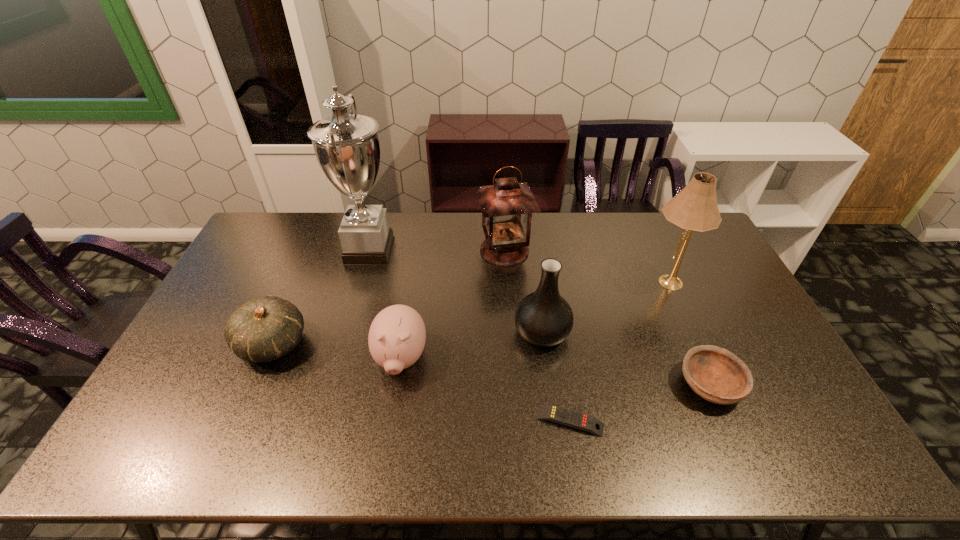
Find the location of a particular element. Image resolution: width=960 pixels, height=540 pixels. trophy cup is located at coordinates (347, 148).

Locate an element on the screen. The image size is (960, 540). the seventh shortest object is located at coordinates (694, 208).

This screenshot has height=540, width=960. In order to click on oil lamp in this screenshot , I will do `click(507, 206)`.

You are a GUI agent. You are given a task and a screenshot of the screen. Output one action in this format:
    pyautogui.click(x=<x>, y=<y>)
    Task: Click on the vase
    
    Given the screenshot: What is the action you would take?
    (544, 318)

Image resolution: width=960 pixels, height=540 pixels. I want to click on piggy bank, so click(397, 335).

I want to click on gourd, so click(263, 329).

You are a GUI agent. You are given a task and a screenshot of the screen. Output one action in this format:
    pyautogui.click(x=<x>, y=<y>)
    Task: Click on the bowl
    
    Given the screenshot: What is the action you would take?
    pyautogui.click(x=717, y=375)

This screenshot has width=960, height=540. What are the coordinates of `the shortest object` in the screenshot? It's located at (552, 413).

The height and width of the screenshot is (540, 960). In order to click on free space located at the front view of the tallest object in this screenshot , I will do `click(453, 251)`.

The image size is (960, 540). Find the location of `vacant space located 0.200m on the front of the seventh shortest object`. vacant space located 0.200m on the front of the seventh shortest object is located at coordinates click(696, 350).